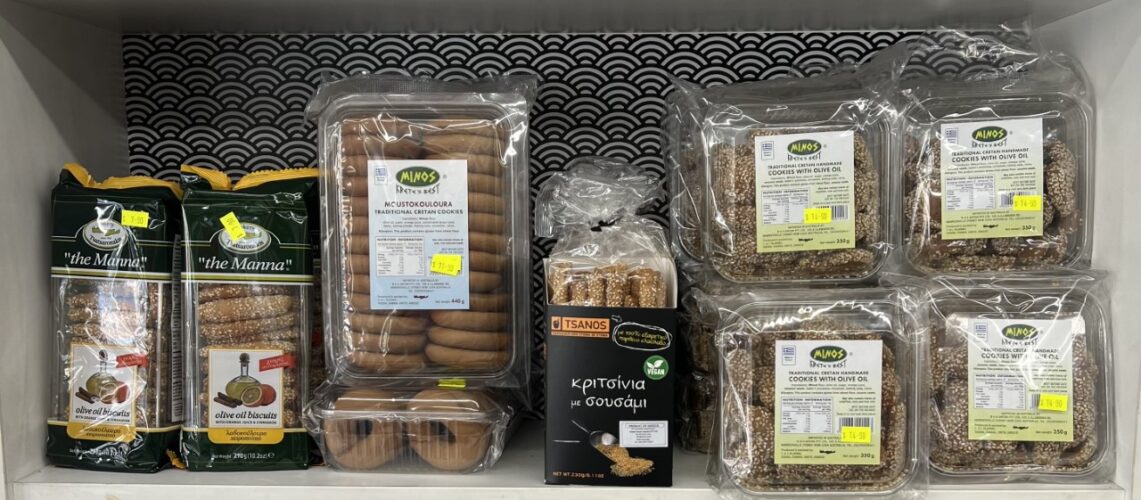
Find the location of a particular element. This screenshot has height=500, width=1141. horizontally placed cookie box is located at coordinates (424, 424).